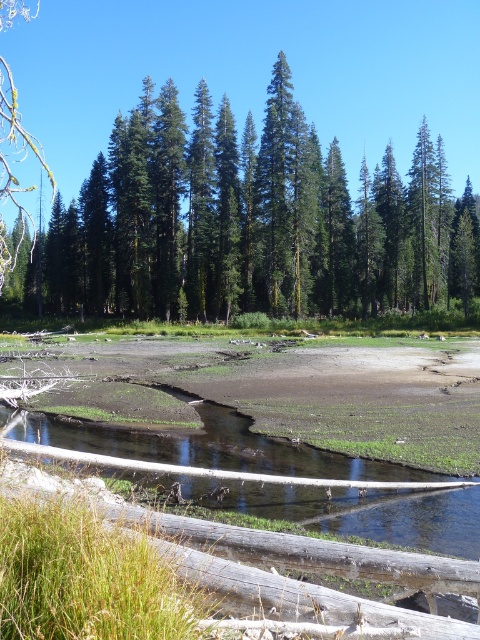
You are a hiker walking along the forest path and see the green matte tree at center and the brown wood log at lower center. Which object is higher up in the image?

The green matte tree at center is above the brown wood log at lower center, so the green matte tree at center is higher up in the image.

Consider the image. You are standing at the point labeled point (245, 224) in the image. What object are you facing?

The point labeled point (245, 224) corresponds to the green matte tree at center, so you are facing the green matte tree at center.